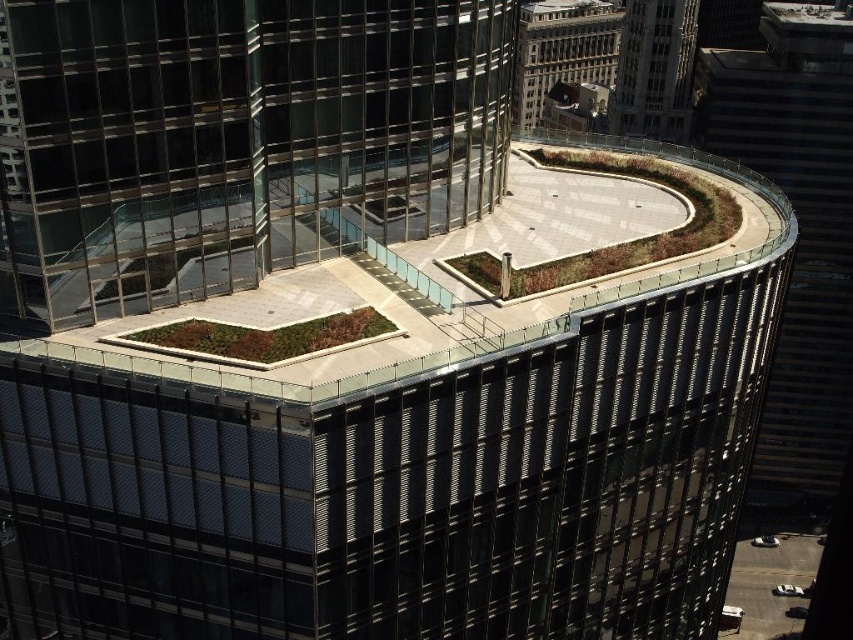
Can you confirm if metallic glass tower at right is thinner than glassy steel skyscraper at upper right?

Incorrect, metallic glass tower at right's width is not less than glassy steel skyscraper at upper right's.

The height and width of the screenshot is (640, 853). Find the location of `metallic glass tower at right`. metallic glass tower at right is located at coordinates (798, 230).

This screenshot has width=853, height=640. I want to click on metallic glass tower at right, so click(x=798, y=230).

Is metallic glass tower at right to the left of matte glass tower at upper center from the viewer's perspective?

No, metallic glass tower at right is not to the left of matte glass tower at upper center.

Is metallic glass tower at right positioned behind matte glass tower at upper center?

That is False.

Between point (804, 394) and point (549, 36), which one is positioned behind?

The point (549, 36) is behind.

Find the location of a particular element. metallic glass tower at right is located at coordinates (798, 230).

Looking at this image, is transparent glass building at upper center closer to camera compared to glassy steel skyscraper at upper right?

Yes, it is.

Does point (201, 129) come closer to viewer compared to point (614, 106)?

Yes, point (201, 129) is in front of point (614, 106).

This screenshot has width=853, height=640. Identify the location of transparent glass building at upper center. (233, 140).